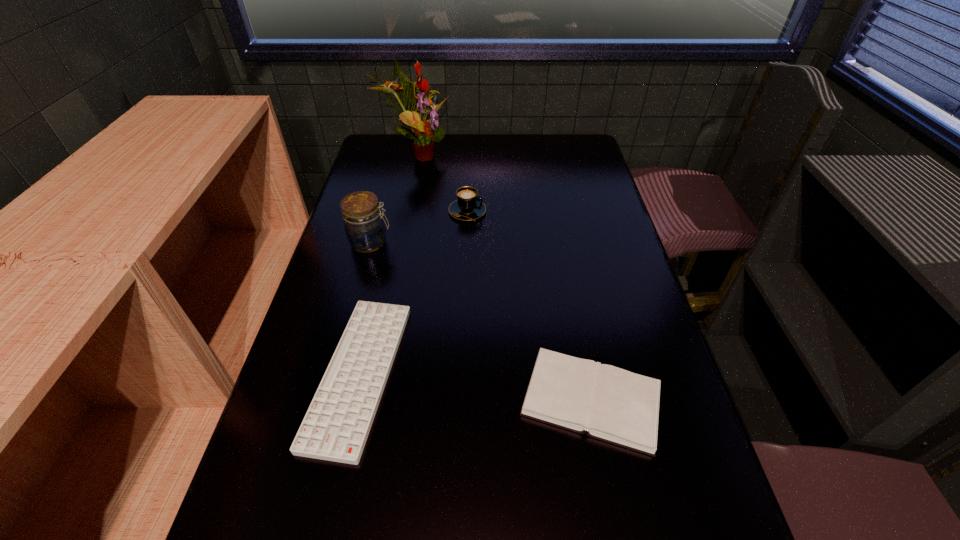
At what (x,y) coordinates should I click in order to perform the action: click on the farthest object. Please return your answer as a coordinate pair (x, y). The height and width of the screenshot is (540, 960). Looking at the image, I should click on (425, 132).

In order to click on bouquet in this screenshot , I will do `click(425, 132)`.

This screenshot has width=960, height=540. Find the location of `jar`. jar is located at coordinates (364, 226).

Locate an element on the screen. This screenshot has width=960, height=540. the third nearest object is located at coordinates (364, 226).

Identify the location of the fourth nearest object. This screenshot has width=960, height=540. (468, 206).

Where is `the second object from right to left`? The width and height of the screenshot is (960, 540). the second object from right to left is located at coordinates (468, 206).

This screenshot has height=540, width=960. In order to click on hardback book in this screenshot , I will do `click(614, 405)`.

The height and width of the screenshot is (540, 960). In order to click on the shortest object in this screenshot , I will do `click(336, 426)`.

In order to click on vacant space located on the front-facing side of the farthest object in this screenshot , I will do `click(498, 155)`.

Where is `vacant space located 0.160m on the lid of the second tallest object`? The height and width of the screenshot is (540, 960). vacant space located 0.160m on the lid of the second tallest object is located at coordinates (447, 242).